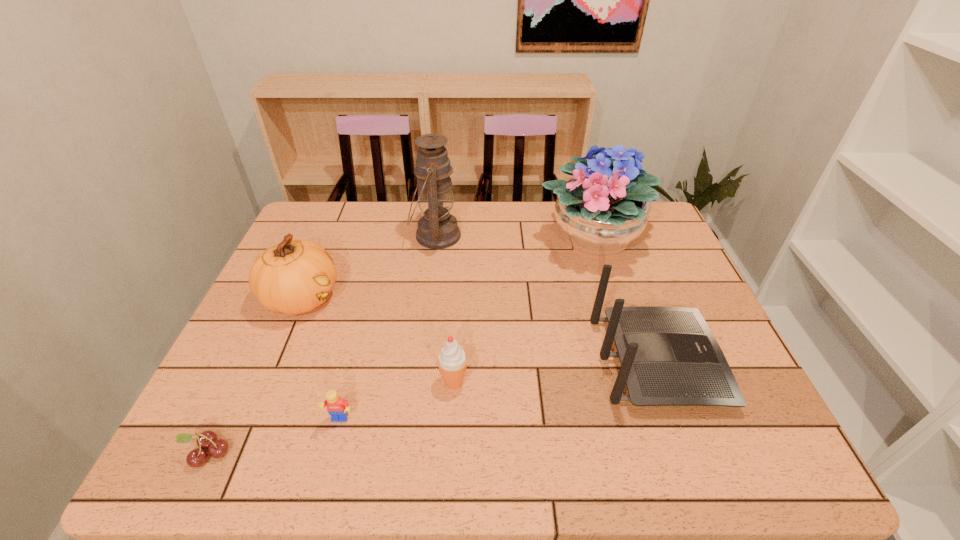
In order to click on free space between the third object from left to right and the pumpkin in this screenshot , I will do `click(321, 359)`.

Image resolution: width=960 pixels, height=540 pixels. I want to click on vacant point located between the oil lamp and the icecream, so click(444, 308).

This screenshot has width=960, height=540. I want to click on vacant region between the sixth tallest object and the fifth tallest object, so click(396, 401).

Where is `free space that is in between the router and the Lego`? The image size is (960, 540). free space that is in between the router and the Lego is located at coordinates (498, 391).

You are a GUI agent. You are given a task and a screenshot of the screen. Output one action in this format:
    pyautogui.click(x=<x>, y=<y>)
    Task: Click on the free space that is in between the nearest object and the fifth tallest object
    The width and height of the screenshot is (960, 540).
    Given the screenshot: What is the action you would take?
    pyautogui.click(x=331, y=417)

Where is `unoccupied position between the pumpkin and the second tallest object`? The width and height of the screenshot is (960, 540). unoccupied position between the pumpkin and the second tallest object is located at coordinates (447, 268).

Identify the location of vacant space that's between the router and the pumpkin. (480, 329).

Find the location of a particular element. This screenshot has height=540, width=960. free space between the router and the third shortest object is located at coordinates (556, 372).

Where is `vacant point located between the sixth shortest object and the pumpkin`? The image size is (960, 540). vacant point located between the sixth shortest object and the pumpkin is located at coordinates (447, 268).

I want to click on vacant area between the fifth tallest object and the sixth shortest object, so click(523, 310).